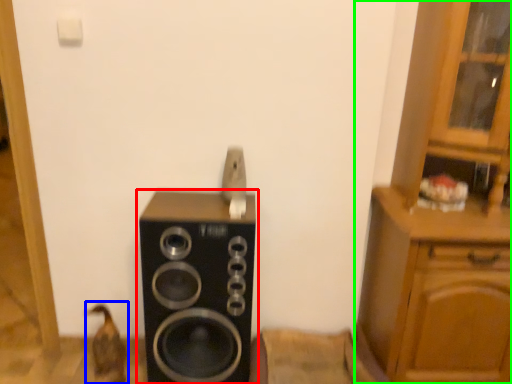
Question: Which is farther away from home appliance (highlighted by a red box)? animal (highlighted by a blue box) or cabinetry (highlighted by a green box)?

Choices:
 (A) animal
 (B) cabinetry

Answer: (B)